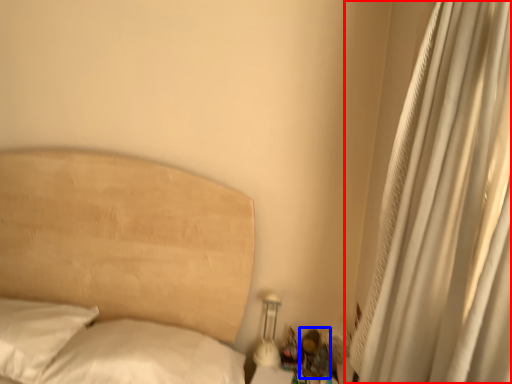
Question: Which object appears farthest to the camera in this image, curtain (highlighted by a red box) or miniature (highlighted by a blue box)?

Choices:
 (A) curtain
 (B) miniature

Answer: (B)